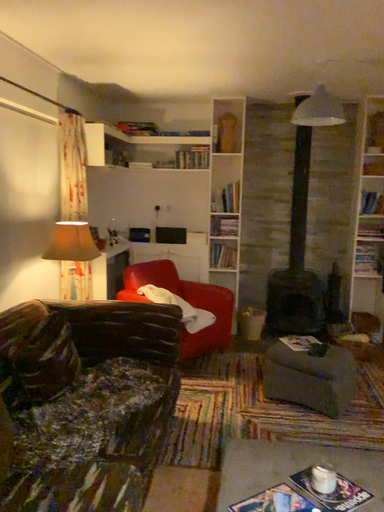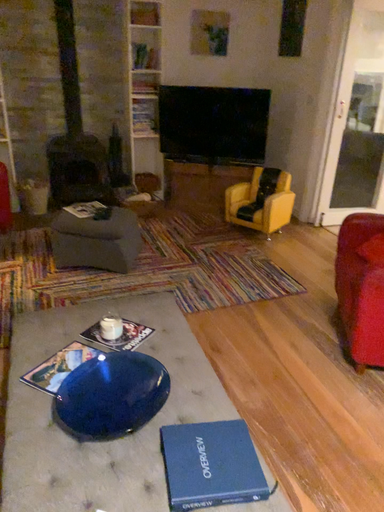
Question: How did the camera likely rotate when shooting the video?

Choices:
 (A) rotated downward
 (B) rotated upward

Answer: (A)